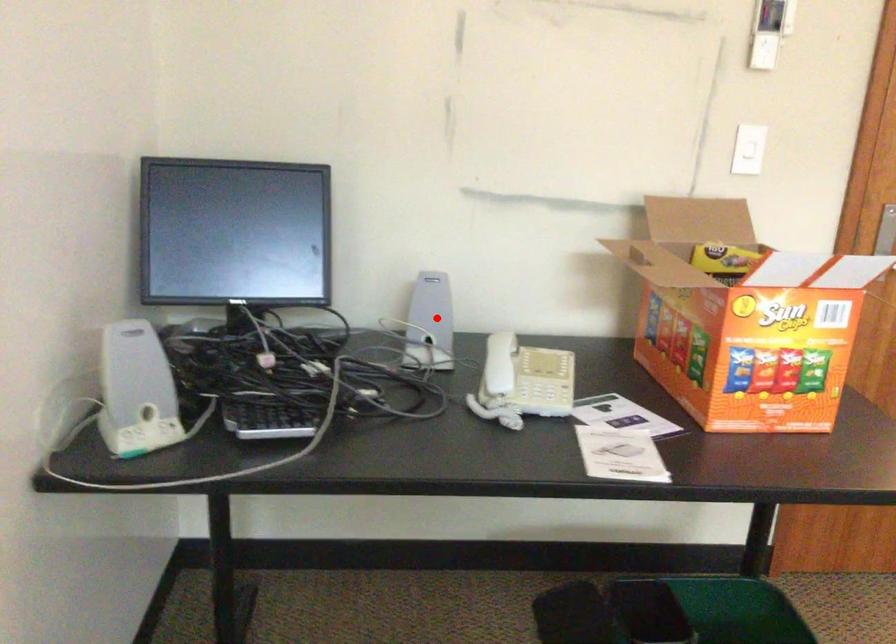
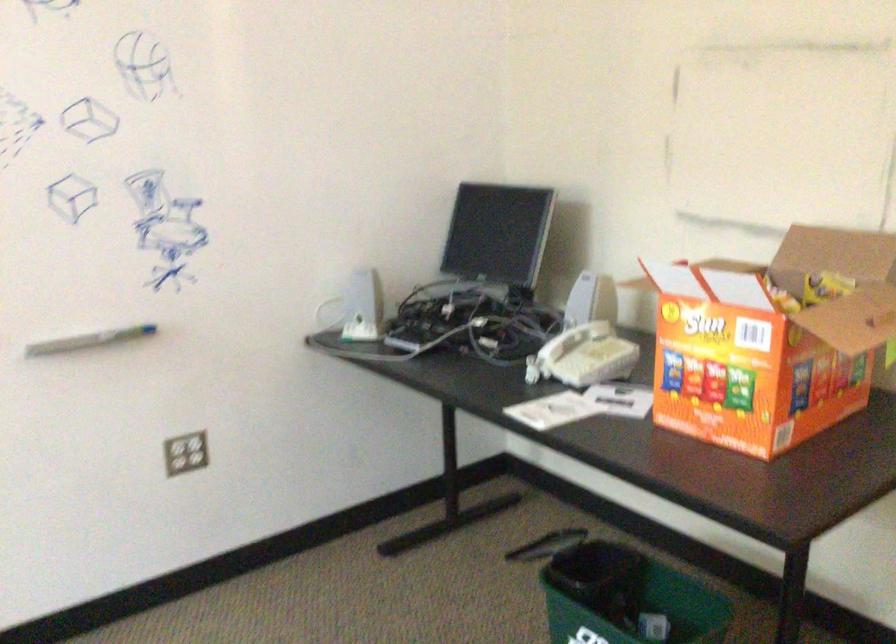
In the second image, find the point that corresponds to the highlighted location in the first image.

(579, 305)